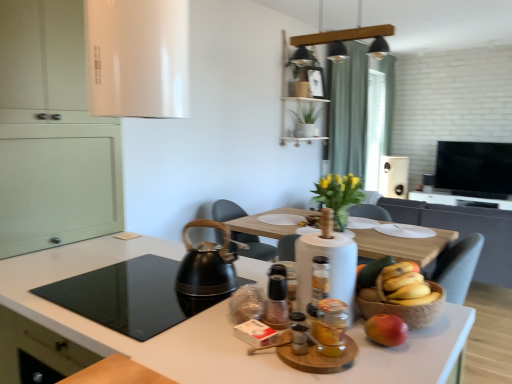
Question: Is yellow matte bananas at center, positioned as the first banana in back-to-front order, bigger or smaller than translucent glass jar at center, the 2th bottle positioned from the front?

Choices:
 (A) small
 (B) big

Answer: (A)

Question: From a real-world perspective, is yellow matte bananas at center, positioned as the first banana in back-to-front order, physically located above or below translucent glass jar at center, the 2th bottle positioned from the front?

Choices:
 (A) above
 (B) below

Answer: (B)

Question: Based on their relative distances, which object is farther from the white plastic toaster at upper right, the first appliance in the back-to-front sequence?

Choices:
 (A) matte green cabinet at left
 (B) yellow matte bananas at center
 (C) white paper towel holder at center, marked as the 2th appliance in a top-to-bottom arrangement
 (D) white glossy countertop at lower left
 (E) matte white vase at center

Answer: (C)

Question: Considering the real-world distances, which object is farthest from the matte white vase at center?

Choices:
 (A) black matte tea kettle at center
 (B) matte green cabinet at left
 (C) white glossy countertop at lower left
 (D) green fabric curtain at upper center
 (E) black glass cooktop at lower left

Answer: (D)